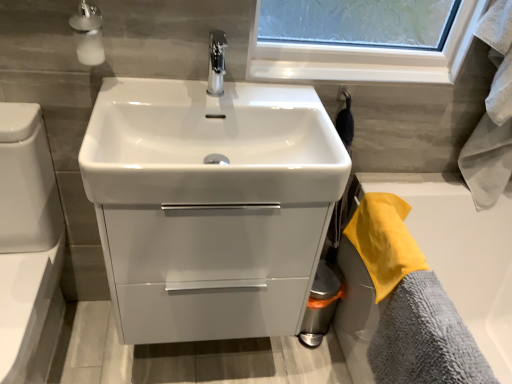
Locate an element on the screen. The height and width of the screenshot is (384, 512). gray microfiber towel at lower right, the 2th bath towel from the top is located at coordinates (425, 338).

Could you tell me if white glossy toilet bowl at lower left is turned towards white glossy sink at center?

No, white glossy toilet bowl at lower left is not aimed at white glossy sink at center.

Considering the positions of objects white glossy toilet bowl at lower left and white glossy sink at center in the image provided, who is more to the left, white glossy toilet bowl at lower left or white glossy sink at center?

white glossy toilet bowl at lower left.

Identify the location of sink above the white glossy toilet bowl at lower left (from the image's perspective). The image size is (512, 384). (210, 203).

Does white glossy toilet bowl at lower left lie in front of white glossy sink at center?

Yes, it is in front of white glossy sink at center.

Is white glossy sink at center in contact with yellow terry cloth towel at right, which appears as the 1th bath towel when viewed from the top?

white glossy sink at center and yellow terry cloth towel at right, which appears as the 1th bath towel when viewed from the top, are clearly separated.

From a real-world perspective, who is located lower, white glossy sink at center or yellow terry cloth towel at right, placed as the 2th bath towel when sorted from bottom to top?

yellow terry cloth towel at right, placed as the 2th bath towel when sorted from bottom to top, from a real-world perspective.

Would you say white glossy sink at center is to the left or to the right of yellow terry cloth towel at right, placed as the 2th bath towel when sorted from bottom to top, in the picture?

white glossy sink at center is positioned on yellow terry cloth towel at right, placed as the 2th bath towel when sorted from bottom to top,'s left side.

From the image's perspective, which object appears higher, white glossy sink at center or yellow terry cloth towel at right, which appears as the 1th bath towel when viewed from the top?

white glossy sink at center is shown above in the image.

From the image's perspective, which object appears higher, gray microfiber towel at lower right, marked as the 1th bath towel in a bottom-to-top arrangement, or satin glass soap dispenser at upper left?

From the image's view, satin glass soap dispenser at upper left is above.

From a real-world perspective, which object stands above the other?

From a 3D spatial view, satin glass soap dispenser at upper left is above.

Which object is positioned more to the left, gray microfiber towel at lower right, marked as the 1th bath towel in a bottom-to-top arrangement, or satin glass soap dispenser at upper left?

satin glass soap dispenser at upper left is more to the left.

From the image's perspective, does yellow terry cloth towel at right, which appears as the 1th bath towel when viewed from the top, appear higher than gray microfiber towel at lower right, marked as the 1th bath towel in a bottom-to-top arrangement?

Yes.

Could you measure the distance between yellow terry cloth towel at right, placed as the 2th bath towel when sorted from bottom to top, and gray microfiber towel at lower right, marked as the 1th bath towel in a bottom-to-top arrangement?

yellow terry cloth towel at right, placed as the 2th bath towel when sorted from bottom to top, and gray microfiber towel at lower right, marked as the 1th bath towel in a bottom-to-top arrangement, are 15.04 centimeters apart from each other.

Is yellow terry cloth towel at right, which appears as the 1th bath towel when viewed from the top, in front of or behind gray microfiber towel at lower right, the 2th bath towel from the top, in the image?

Clearly, yellow terry cloth towel at right, which appears as the 1th bath towel when viewed from the top, is behind gray microfiber towel at lower right, the 2th bath towel from the top.

Is white glossy toilet bowl at lower left not within gray microfiber towel at lower right, marked as the 1th bath towel in a bottom-to-top arrangement?

Indeed, white glossy toilet bowl at lower left is completely outside gray microfiber towel at lower right, marked as the 1th bath towel in a bottom-to-top arrangement.

From the image's perspective, is white glossy toilet bowl at lower left positioned above or below gray microfiber towel at lower right, marked as the 1th bath towel in a bottom-to-top arrangement?

white glossy toilet bowl at lower left is situated higher than gray microfiber towel at lower right, marked as the 1th bath towel in a bottom-to-top arrangement, in the image.

How much distance is there between white glossy toilet bowl at lower left and gray microfiber towel at lower right, marked as the 1th bath towel in a bottom-to-top arrangement?

The distance of white glossy toilet bowl at lower left from gray microfiber towel at lower right, marked as the 1th bath towel in a bottom-to-top arrangement, is 37.33 inches.

Considering their positions, is white glossy toilet bowl at lower left located in front of or behind gray microfiber towel at lower right, marked as the 1th bath towel in a bottom-to-top arrangement?

Visually, white glossy toilet bowl at lower left is located in front of gray microfiber towel at lower right, marked as the 1th bath towel in a bottom-to-top arrangement.

Is yellow terry cloth towel at right, which appears as the 1th bath towel when viewed from the top, taller or shorter than white glossy sink at center?

Clearly, yellow terry cloth towel at right, which appears as the 1th bath towel when viewed from the top, is shorter compared to white glossy sink at center.

Choose the correct answer: Is yellow terry cloth towel at right, which appears as the 1th bath towel when viewed from the top, inside white glossy sink at center or outside it?

yellow terry cloth towel at right, which appears as the 1th bath towel when viewed from the top, lies outside white glossy sink at center.

In terms of size, does yellow terry cloth towel at right, placed as the 2th bath towel when sorted from bottom to top, appear bigger or smaller than white glossy sink at center?

Clearly, yellow terry cloth towel at right, placed as the 2th bath towel when sorted from bottom to top, is smaller in size than white glossy sink at center.

Based on the photo, is yellow terry cloth towel at right, which appears as the 1th bath towel when viewed from the top, wider than white glossy sink at center?

Incorrect, the width of yellow terry cloth towel at right, which appears as the 1th bath towel when viewed from the top, does not surpass that of white glossy sink at center.

Which of these two, gray microfiber towel at lower right, the 2th bath towel from the top, or white glossy sink at center, is smaller?

Smaller between the two is gray microfiber towel at lower right, the 2th bath towel from the top.

Are gray microfiber towel at lower right, marked as the 1th bath towel in a bottom-to-top arrangement, and white glossy sink at center making contact?

gray microfiber towel at lower right, marked as the 1th bath towel in a bottom-to-top arrangement, is not next to white glossy sink at center, and they're not touching.

Based on the photo, considering the relative positions of gray microfiber towel at lower right, the 2th bath towel from the top, and white glossy sink at center in the image provided, is gray microfiber towel at lower right, the 2th bath towel from the top, to the left of white glossy sink at center from the viewer's perspective?

In fact, gray microfiber towel at lower right, the 2th bath towel from the top, is to the right of white glossy sink at center.

Locate an element on the screen. the 2nd bath towel positioned below the white glossy sink at center (from a real-world perspective) is located at coordinates (425, 338).

Locate an element on the screen. Image resolution: width=512 pixels, height=384 pixels. sink above the white glossy toilet bowl at lower left (from a real-world perspective) is located at coordinates (210, 203).

Where is `the 1st bath towel positioned below the white glossy sink at center (from a real-world perspective)`? This screenshot has height=384, width=512. the 1st bath towel positioned below the white glossy sink at center (from a real-world perspective) is located at coordinates (384, 241).

Estimate the real-world distances between objects in this image. Which object is further from gray microfiber towel at lower right, the 2th bath towel from the top, white glossy toilet bowl at lower left or satin glass soap dispenser at upper left?

Among the two, satin glass soap dispenser at upper left is located further to gray microfiber towel at lower right, the 2th bath towel from the top.

Based on their spatial positions, is white glossy sink at center or white glossy toilet bowl at lower left further from satin glass soap dispenser at upper left?

white glossy sink at center is further to satin glass soap dispenser at upper left.

Which object lies further to the anchor point yellow terry cloth towel at right, placed as the 2th bath towel when sorted from bottom to top, white glossy sink at center or white glossy toilet bowl at lower left?

white glossy toilet bowl at lower left lies further to yellow terry cloth towel at right, placed as the 2th bath towel when sorted from bottom to top, than the other object.

Looking at the image, which one is located further to white glossy sink at center, satin glass soap dispenser at upper left or gray microfiber towel at lower right, the 2th bath towel from the top?

satin glass soap dispenser at upper left is further to white glossy sink at center.

When comparing their distances from white glossy toilet bowl at lower left, does gray microfiber towel at lower right, the 2th bath towel from the top, or satin glass soap dispenser at upper left seem closer?

Based on the image, satin glass soap dispenser at upper left appears to be nearer to white glossy toilet bowl at lower left.

From the picture: From the image, which object appears to be nearer to white glossy sink at center, yellow terry cloth towel at right, placed as the 2th bath towel when sorted from bottom to top, or satin glass soap dispenser at upper left?

yellow terry cloth towel at right, placed as the 2th bath towel when sorted from bottom to top.

Estimate the real-world distances between objects in this image. Which object is closer to white glossy toilet bowl at lower left, yellow terry cloth towel at right, which appears as the 1th bath towel when viewed from the top, or satin glass soap dispenser at upper left?

satin glass soap dispenser at upper left is closer to white glossy toilet bowl at lower left.

Which object lies nearer to the anchor point satin glass soap dispenser at upper left, white glossy toilet bowl at lower left or white glossy sink at center?

The object closer to satin glass soap dispenser at upper left is white glossy toilet bowl at lower left.

In order to click on sink between satin glass soap dispenser at upper left and white glossy toilet bowl at lower left vertically in this screenshot , I will do `click(210, 203)`.

The height and width of the screenshot is (384, 512). Identify the location of sink between white glossy toilet bowl at lower left and gray microfiber towel at lower right, the 2th bath towel from the top, from left to right. (210, 203).

Identify the location of sink situated between satin glass soap dispenser at upper left and gray microfiber towel at lower right, the 2th bath towel from the top, from left to right. (210, 203).

Identify the location of soap dispenser between white glossy toilet bowl at lower left and gray microfiber towel at lower right, the 2th bath towel from the top, from left to right. (88, 34).